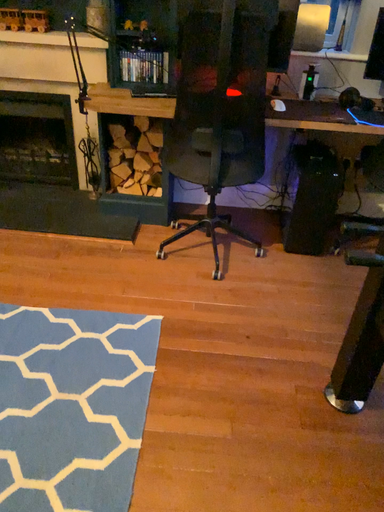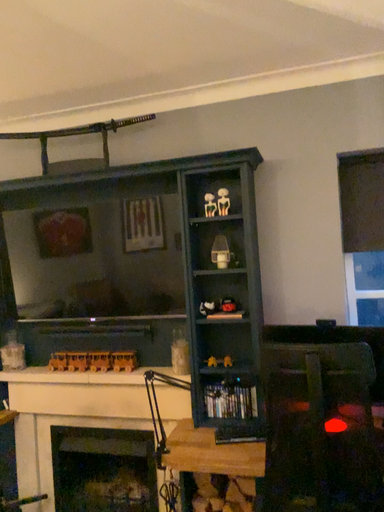
Question: Which way did the camera rotate in the video?

Choices:
 (A) rotated left
 (B) rotated right

Answer: (A)